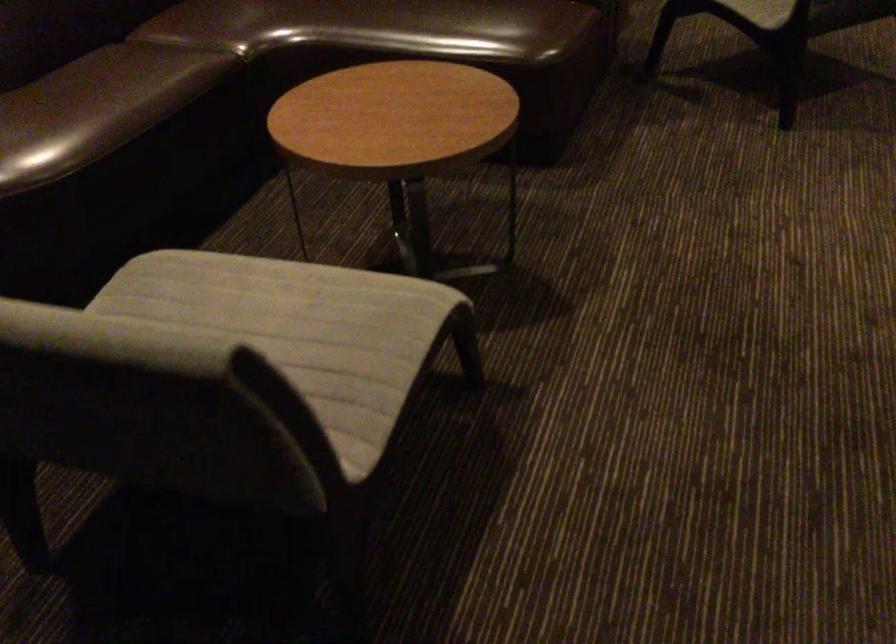
Identify the location of grey chair sitting surface. (280, 299).